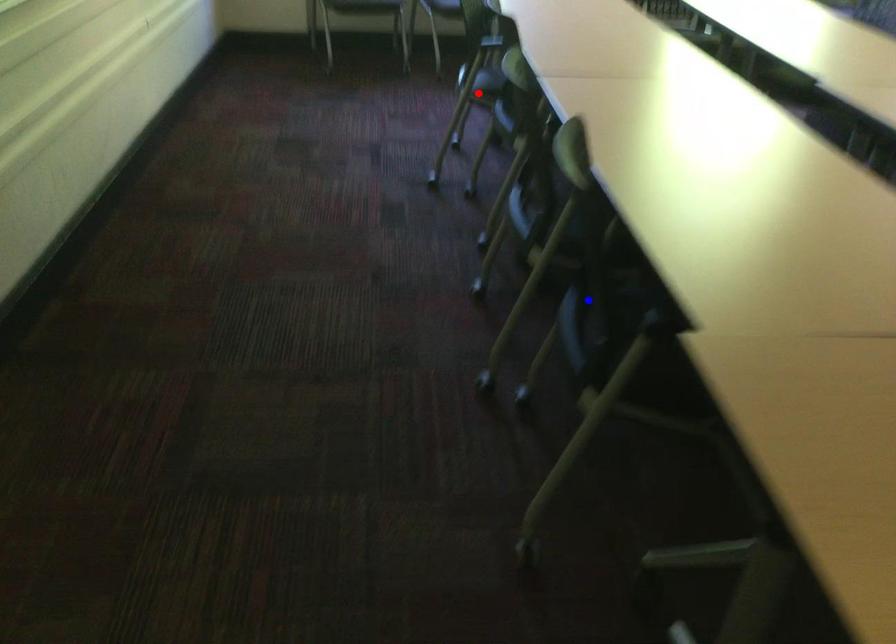
Question: In the image, two points are highlighted. Which point is nearer to the camera? Reply with the corresponding letter.

Choices:
 (A) blue point
 (B) red point

Answer: (A)